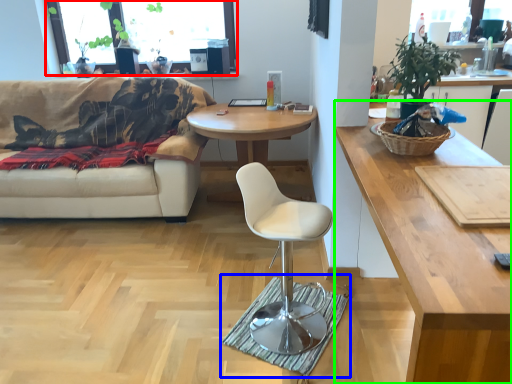
Question: Which object is the farthest from window screen (highlighted by a red box)? Choose among these: mat (highlighted by a blue box) or coffee table (highlighted by a green box).

Choices:
 (A) mat
 (B) coffee table

Answer: (B)